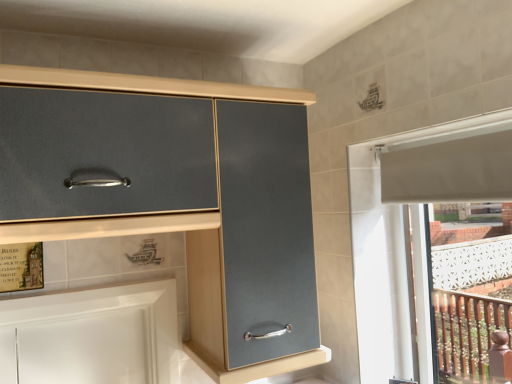
This screenshot has height=384, width=512. Describe the element at coordinates (92, 336) in the screenshot. I see `white glossy cabinet at lower left, which is the first cabinetry from bottom to top` at that location.

The height and width of the screenshot is (384, 512). Find the location of `white glossy cabinet at lower left, which is the first cabinetry from bottom to top`. white glossy cabinet at lower left, which is the first cabinetry from bottom to top is located at coordinates (92, 336).

In order to face white glossy cabinet at lower left, which is the first cabinetry from bottom to top, should I rotate leftwards or rightwards?

You should look left and rotate roughly 20.731 degrees.

This screenshot has height=384, width=512. I want to click on matte gray cabinet at center, the 1th cabinetry viewed from the top, so click(x=193, y=211).

This screenshot has width=512, height=384. What do you see at coordinates (193, 211) in the screenshot?
I see `matte gray cabinet at center, which is the second cabinetry from bottom to top` at bounding box center [193, 211].

Looking at this image, what is the approximate width of matte gray cabinet at center, which is the second cabinetry from bottom to top?

matte gray cabinet at center, which is the second cabinetry from bottom to top, is 14.82 inches wide.

Image resolution: width=512 pixels, height=384 pixels. I want to click on white glossy cabinet at lower left, which is the first cabinetry from bottom to top, so click(x=92, y=336).

Is matte gray cabinet at center, which is the second cabinetry from bottom to top, to the left of white glossy cabinet at lower left, the 2th cabinetry when ordered from top to bottom, from the viewer's perspective?

Result: In fact, matte gray cabinet at center, which is the second cabinetry from bottom to top, is to the right of white glossy cabinet at lower left, the 2th cabinetry when ordered from top to bottom.

Which object is more forward, matte gray cabinet at center, the 1th cabinetry viewed from the top, or white glossy cabinet at lower left, the 2th cabinetry when ordered from top to bottom?

Positioned in front is matte gray cabinet at center, the 1th cabinetry viewed from the top.

Which is closer to the camera, (302, 359) or (147, 346)?

Positioned in front is point (302, 359).

From the image's perspective, is matte gray cabinet at center, the 1th cabinetry viewed from the top, located above or below white glossy cabinet at lower left, the 2th cabinetry when ordered from top to bottom?

Clearly, from the image's perspective, matte gray cabinet at center, the 1th cabinetry viewed from the top, is above white glossy cabinet at lower left, the 2th cabinetry when ordered from top to bottom.

From a real-world perspective, is matte gray cabinet at center, which is the second cabinetry from bottom to top, physically located above or below white glossy cabinet at lower left, the 2th cabinetry when ordered from top to bottom?

matte gray cabinet at center, which is the second cabinetry from bottom to top, is situated higher than white glossy cabinet at lower left, the 2th cabinetry when ordered from top to bottom, in the real world.

Considering the sizes of objects matte gray cabinet at center, the 1th cabinetry viewed from the top, and white glossy cabinet at lower left, the 2th cabinetry when ordered from top to bottom, in the image provided, who is wider, matte gray cabinet at center, the 1th cabinetry viewed from the top, or white glossy cabinet at lower left, the 2th cabinetry when ordered from top to bottom,?

matte gray cabinet at center, the 1th cabinetry viewed from the top, is wider.

Is matte gray cabinet at center, the 1th cabinetry viewed from the top, taller than white glossy cabinet at lower left, which is the first cabinetry from bottom to top?

Indeed, matte gray cabinet at center, the 1th cabinetry viewed from the top, has a greater height compared to white glossy cabinet at lower left, which is the first cabinetry from bottom to top.

Between matte gray cabinet at center, the 1th cabinetry viewed from the top, and white glossy cabinet at lower left, the 2th cabinetry when ordered from top to bottom, which one has larger size?

matte gray cabinet at center, the 1th cabinetry viewed from the top, is bigger.

Can we say matte gray cabinet at center, the 1th cabinetry viewed from the top, lies outside white glossy cabinet at lower left, the 2th cabinetry when ordered from top to bottom?

matte gray cabinet at center, the 1th cabinetry viewed from the top, is positioned outside white glossy cabinet at lower left, the 2th cabinetry when ordered from top to bottom.

Is matte gray cabinet at center, the 1th cabinetry viewed from the top, beside white glossy cabinet at lower left, the 2th cabinetry when ordered from top to bottom?

matte gray cabinet at center, the 1th cabinetry viewed from the top, is not next to white glossy cabinet at lower left, the 2th cabinetry when ordered from top to bottom, and they're not touching.

Is matte gray cabinet at center, the 1th cabinetry viewed from the top, oriented towards white glossy cabinet at lower left, the 2th cabinetry when ordered from top to bottom?

No, matte gray cabinet at center, the 1th cabinetry viewed from the top, is not turned towards white glossy cabinet at lower left, the 2th cabinetry when ordered from top to bottom.

In the image, there is a matte gray cabinet at center, which is the second cabinetry from bottom to top. Identify the location of cabinetry below it (from the image's perspective). This screenshot has width=512, height=384. (92, 336).

Can you confirm if white glossy cabinet at lower left, the 2th cabinetry when ordered from top to bottom, is positioned to the left of matte gray cabinet at center, the 1th cabinetry viewed from the top?

Yes, white glossy cabinet at lower left, the 2th cabinetry when ordered from top to bottom, is to the left of matte gray cabinet at center, the 1th cabinetry viewed from the top.

Which object is more forward, white glossy cabinet at lower left, the 2th cabinetry when ordered from top to bottom, or matte gray cabinet at center, which is the second cabinetry from bottom to top?

matte gray cabinet at center, which is the second cabinetry from bottom to top, is more forward.

Considering the positions of points (88, 342) and (211, 333), is point (88, 342) closer to camera compared to point (211, 333)?

No.

From the image's perspective, is white glossy cabinet at lower left, the 2th cabinetry when ordered from top to bottom, above or below matte gray cabinet at center, the 1th cabinetry viewed from the top?

white glossy cabinet at lower left, the 2th cabinetry when ordered from top to bottom, is below matte gray cabinet at center, the 1th cabinetry viewed from the top.

From a real-world perspective, does white glossy cabinet at lower left, which is the first cabinetry from bottom to top, stand above matte gray cabinet at center, which is the second cabinetry from bottom to top?

No, from a real-world perspective, white glossy cabinet at lower left, which is the first cabinetry from bottom to top, is not above matte gray cabinet at center, which is the second cabinetry from bottom to top.

Between white glossy cabinet at lower left, the 2th cabinetry when ordered from top to bottom, and matte gray cabinet at center, the 1th cabinetry viewed from the top, which one has smaller width?

With smaller width is white glossy cabinet at lower left, the 2th cabinetry when ordered from top to bottom.

Can you confirm if white glossy cabinet at lower left, the 2th cabinetry when ordered from top to bottom, is shorter than matte gray cabinet at center, the 1th cabinetry viewed from the top?

Yes.

Considering the sizes of white glossy cabinet at lower left, which is the first cabinetry from bottom to top, and matte gray cabinet at center, the 1th cabinetry viewed from the top, in the image, is white glossy cabinet at lower left, which is the first cabinetry from bottom to top, bigger or smaller than matte gray cabinet at center, the 1th cabinetry viewed from the top,?

Clearly, white glossy cabinet at lower left, which is the first cabinetry from bottom to top, is smaller in size than matte gray cabinet at center, the 1th cabinetry viewed from the top.

Can we say white glossy cabinet at lower left, which is the first cabinetry from bottom to top, lies outside matte gray cabinet at center, which is the second cabinetry from bottom to top?

That's correct, white glossy cabinet at lower left, which is the first cabinetry from bottom to top, is outside of matte gray cabinet at center, which is the second cabinetry from bottom to top.

Can you see white glossy cabinet at lower left, the 2th cabinetry when ordered from top to bottom, touching matte gray cabinet at center, which is the second cabinetry from bottom to top?

No, white glossy cabinet at lower left, the 2th cabinetry when ordered from top to bottom, is not beside matte gray cabinet at center, which is the second cabinetry from bottom to top.

From the picture: Is white glossy cabinet at lower left, the 2th cabinetry when ordered from top to bottom, oriented away from matte gray cabinet at center, the 1th cabinetry viewed from the top?

No, white glossy cabinet at lower left, the 2th cabinetry when ordered from top to bottom, is not facing the opposite direction of matte gray cabinet at center, the 1th cabinetry viewed from the top.

How far apart are white glossy cabinet at lower left, which is the first cabinetry from bottom to top, and matte gray cabinet at center, which is the second cabinetry from bottom to top?

white glossy cabinet at lower left, which is the first cabinetry from bottom to top, and matte gray cabinet at center, which is the second cabinetry from bottom to top, are 13.68 inches apart.

In the image, there is a matte gray cabinet at center, which is the second cabinetry from bottom to top. At what (x,y) coordinates should I click in order to perform the action: click on cabinetry below it (from the image's perspective). Please return your answer as a coordinate pair (x, y). The image size is (512, 384). Looking at the image, I should click on (92, 336).

Locate an element on the screen. This screenshot has width=512, height=384. cabinetry above the white glossy cabinet at lower left, which is the first cabinetry from bottom to top (from a real-world perspective) is located at coordinates (193, 211).

Locate an element on the screen. cabinetry in front of the white glossy cabinet at lower left, the 2th cabinetry when ordered from top to bottom is located at coordinates (193, 211).